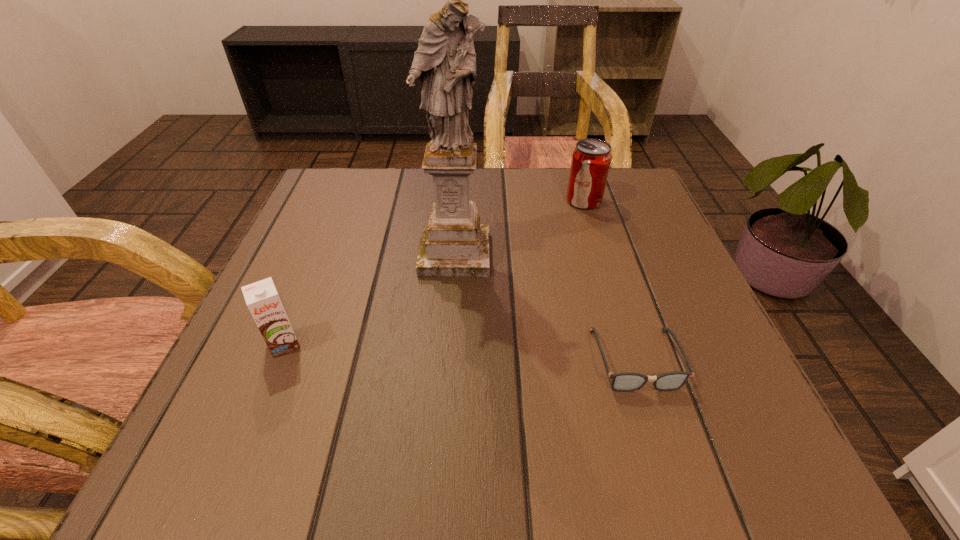
In the image, there is a desktop. Where is `free space at the near right corner`? The height and width of the screenshot is (540, 960). free space at the near right corner is located at coordinates (746, 435).

Where is `free space that is in between the shortest object and the sculpture`? free space that is in between the shortest object and the sculpture is located at coordinates (545, 307).

Locate an element on the screen. This screenshot has width=960, height=540. free space between the shortest object and the leftmost object is located at coordinates (460, 352).

The image size is (960, 540). I want to click on empty space between the pop soda and the spectacles, so click(610, 280).

Where is `vacant region between the spectacles and the leftmost object`? The height and width of the screenshot is (540, 960). vacant region between the spectacles and the leftmost object is located at coordinates (460, 352).

At what (x,y) coordinates should I click in order to perform the action: click on free space between the shortest object and the second object from left to right. Please return your answer as a coordinate pair (x, y). This screenshot has height=540, width=960. Looking at the image, I should click on (545, 307).

I want to click on unoccupied position between the spectacles and the pop soda, so click(x=610, y=280).

Locate an element on the screen. empty location between the leftmost object and the spectacles is located at coordinates (460, 352).

Identify the location of free space that is in between the second object from left to right and the shortest object. (545, 307).

Locate which object is the closest to the spectacles. Please provide its 2D coordinates. Your answer should be formatted as a tuple, i.e. [(x, y)], where the tuple contains the x and y coordinates of a point satisfying the conditions above.

[(454, 244)]